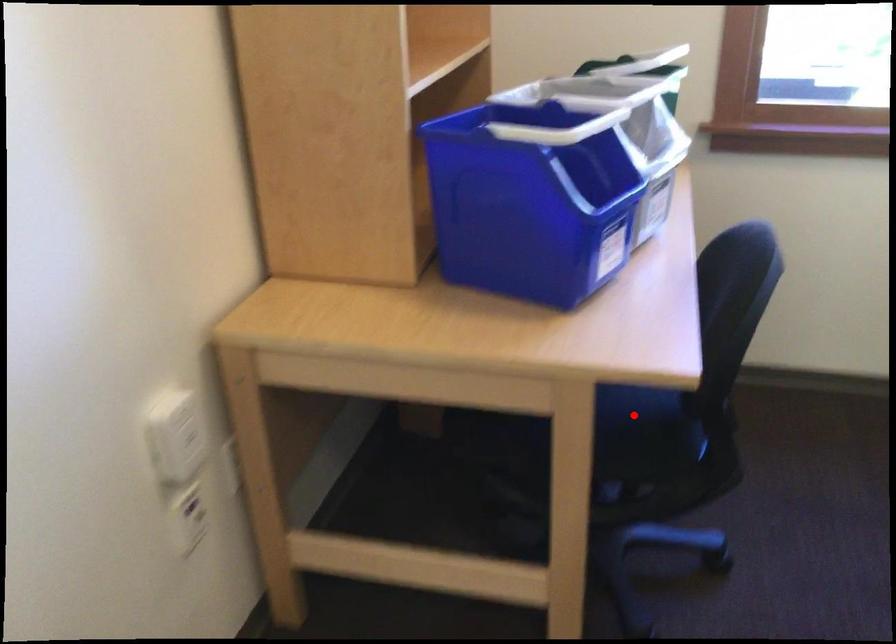
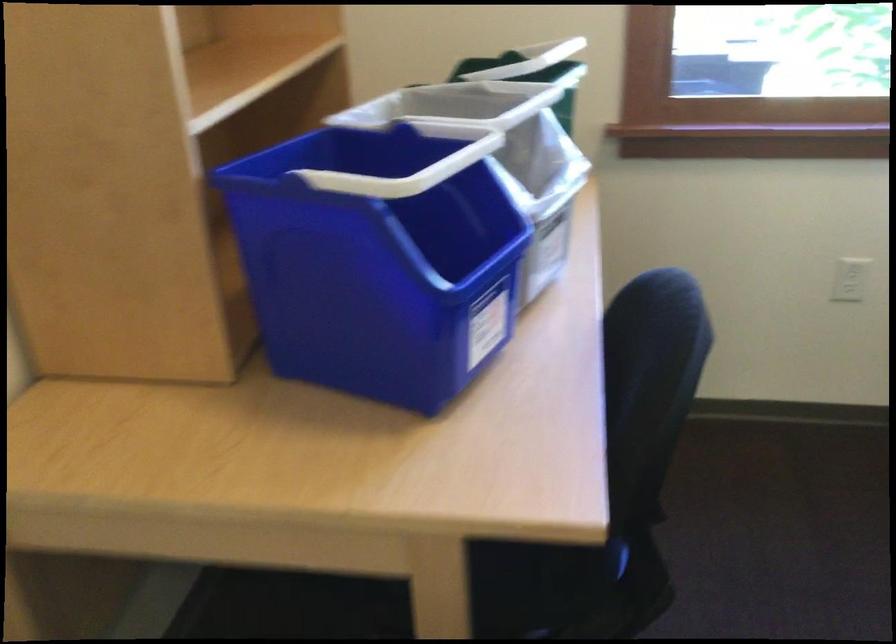
Question: I am providing you with two images of the same scene from different viewpoints. A red point is marked on the first image. Can you still see the location of the red point in image 2?

Choices:
 (A) Yes
 (B) No

Answer: (B)